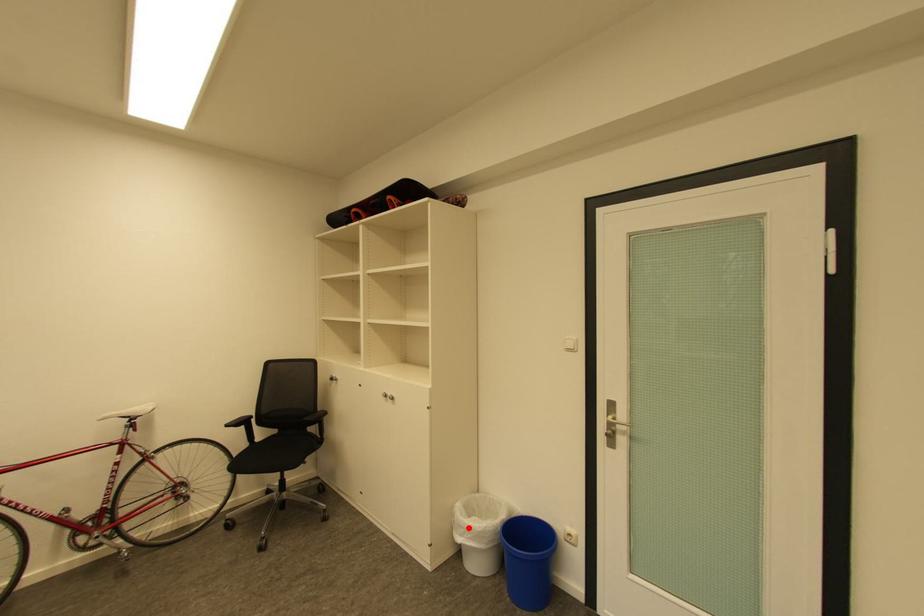
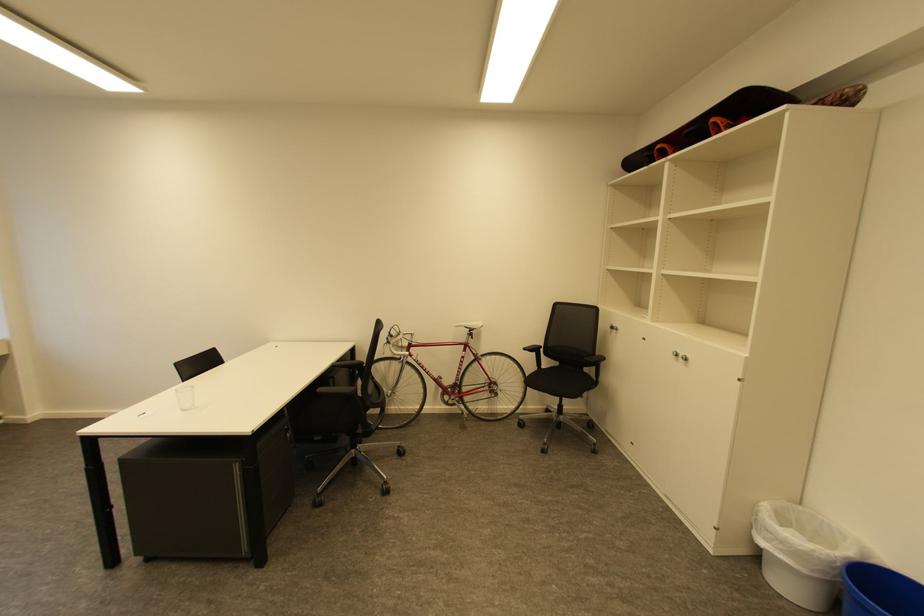
Find the pixel in the second image that matches the highlighted location in the first image.

(775, 533)